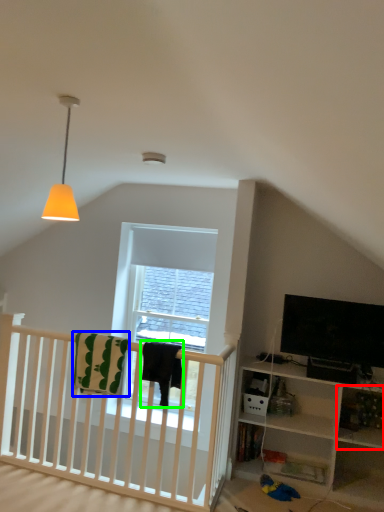
Question: Which object is positioned closest to shelf (highlighted by a red box)? Select from blanket (highlighted by a blue box) and blanket (highlighted by a green box).

Choices:
 (A) blanket
 (B) blanket

Answer: (B)